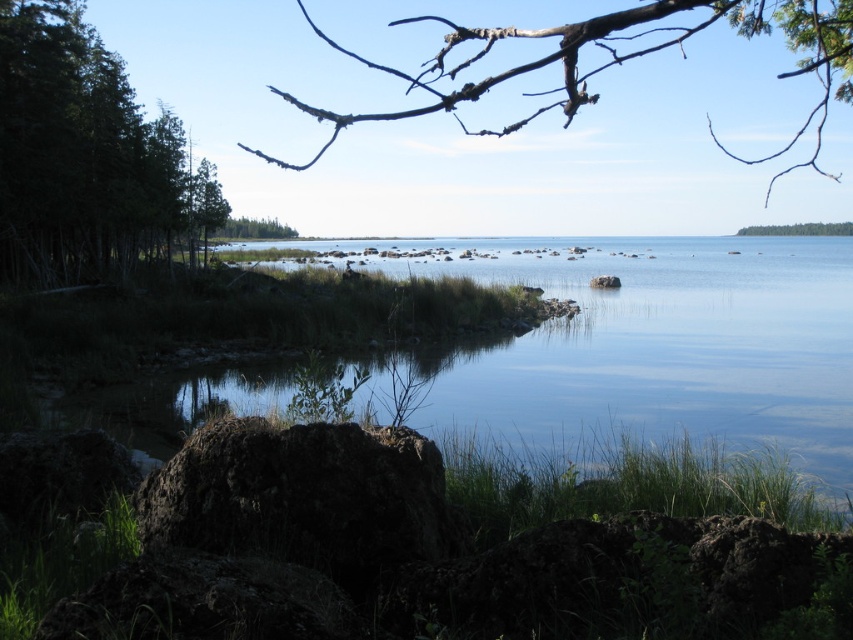
Question: Can you confirm if clear water at center is positioned above green matte tree at center?

Choices:
 (A) yes
 (B) no

Answer: (B)

Question: Which is nearer to the green leafy tree at upper right?

Choices:
 (A) brown/dry wood branches at upper center
 (B) green matte tree at center

Answer: (A)

Question: Is green matte trees at left thinner than rusty metallic rock at lower center?

Choices:
 (A) yes
 (B) no

Answer: (B)

Question: Does brown/dry wood branches at upper center appear on the right side of green leafy tree at upper right?

Choices:
 (A) yes
 (B) no

Answer: (B)

Question: Which object appears farthest from the camera in this image?

Choices:
 (A) clear water at center
 (B) green leafy tree at upper right
 (C) rusty metallic rock at lower center

Answer: (B)

Question: Which point is farther to the camera?

Choices:
 (A) (779, 236)
 (B) (257, 236)
 (C) (103, 141)
 (D) (751, 20)

Answer: (A)